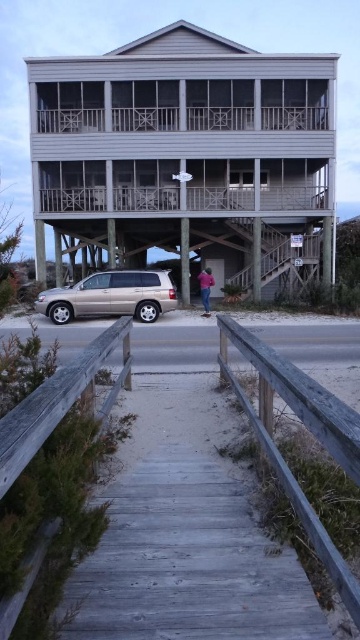
Does weathered wood boardwalk at center come behind gold metallic minivan at lower left?

No.

Does weathered wood boardwalk at center appear on the left side of gold metallic minivan at lower left?

Incorrect, weathered wood boardwalk at center is not on the left side of gold metallic minivan at lower left.

Is point (61, 600) positioned behind point (146, 321)?

No, it is in front of (146, 321).

Image resolution: width=360 pixels, height=640 pixels. Identify the location of weathered wood boardwalk at center. (x=186, y=536).

Which is in front, point (326, 404) or point (110, 296)?

Positioned in front is point (326, 404).

How distant is wooden rail at center from gold metallic minivan at lower left?

wooden rail at center is 14.26 meters from gold metallic minivan at lower left.

Locate an element on the screen. wooden rail at center is located at coordinates (308, 429).

Does gold metallic minivan at lower left have a lesser width compared to pink fabric at lower center?

In fact, gold metallic minivan at lower left might be wider than pink fabric at lower center.

Which is more to the right, gold metallic minivan at lower left or pink fabric at lower center?

pink fabric at lower center

Is point (153, 310) behind point (204, 310)?

No, it is not.

Locate an element on the screen. This screenshot has width=360, height=640. gold metallic minivan at lower left is located at coordinates (110, 296).